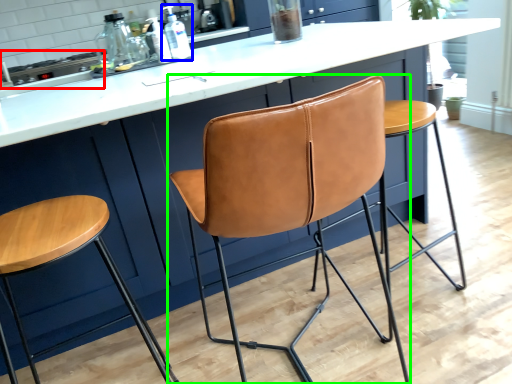
Question: Considering the real-world distances, which object is closest to appliance (highlighted by a red box)? bottle (highlighted by a blue box) or chair (highlighted by a green box).

Choices:
 (A) bottle
 (B) chair

Answer: (A)